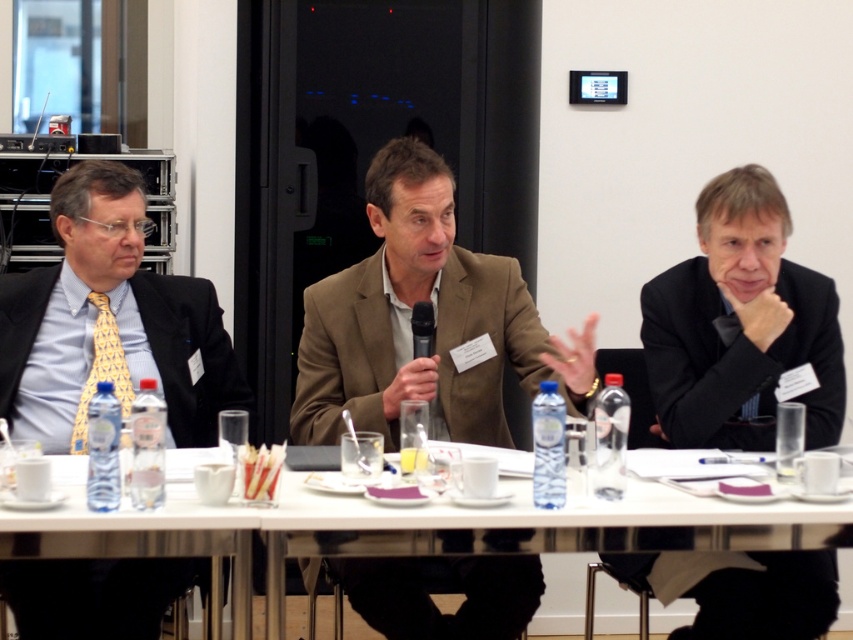
You are organizing a small event and need to place a 2 meter long banner along the length of the white plastic table at center. Considering the presence of the matte black suit at left, will the banner fit along the table?

The white plastic table at center is wider than the matte black suit at left, so the banner may fit along the table as the table is wider. However, the description only mentions the table being wider in width compared to the suit, not its length. The banner length requirement is 2 meters, but there is no information provided about the table length. Therefore, it is uncertain if the banner will fit based on the given details.

You are organizing a photoshoot and need to place a small decorative item between the matte black suit at left and the yellowgeometric patterned fabrictie at left. Based on their widths, which object should the item be closer to?

The small decorative item should be placed closer to the yellowgeometric patterned fabrictie at left because the matte black suit at left is wider, leaving less space between them. Since the yellowgeometric patterned fabrictie at left is narrower, there will be more space available next to it for the decorative item.

You are a guest arriving at the meeting and need to sit down. There is a white plastic table at center and a matte black suit at left. Which object is lower to the ground so you can sit on it?

The white plastic table at center is shorter than the matte black suit at left, so you can sit on the white plastic table at center since it is lower to the ground.